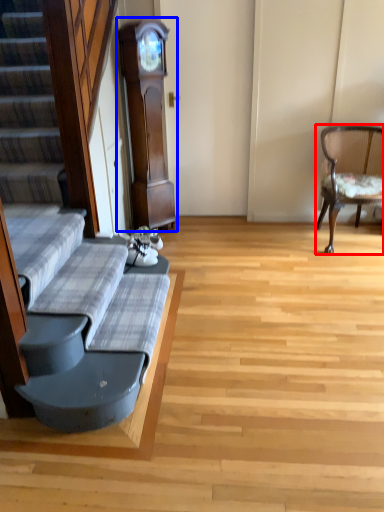
Question: Which of the following is the farthest to the observer, chair (highlighted by a red box) or cabinetry (highlighted by a blue box)?

Choices:
 (A) chair
 (B) cabinetry

Answer: (B)